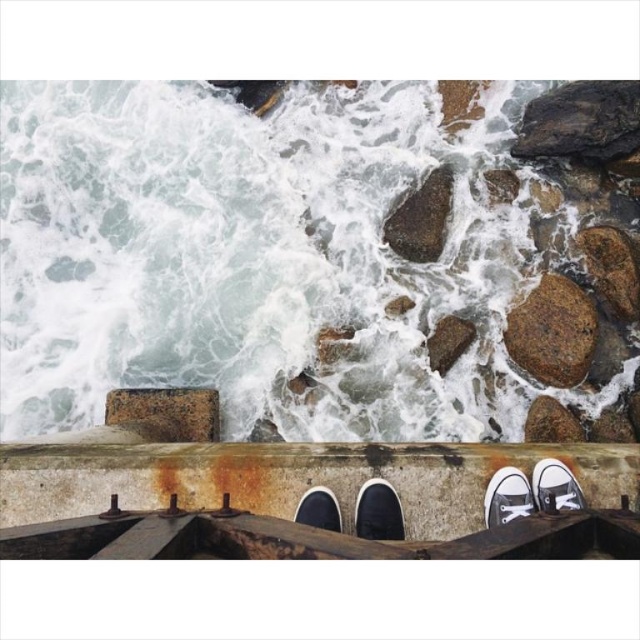
Does white canvas shoe at lower right appear on the left side of white canvas shoe at center?

In fact, white canvas shoe at lower right is to the right of white canvas shoe at center.

Does white canvas shoe at lower right have a greater height compared to white canvas shoe at center?

Yes, white canvas shoe at lower right is taller than white canvas shoe at center.

Is point (524, 480) more distant than point (305, 493)?

No.

What are the coordinates of `white canvas shoe at lower right` in the screenshot? It's located at (508, 497).

Between rusty concrete ledge at lower center and rusty stone at center-right, which one is positioned higher?

Positioned higher is rusty stone at center-right.

Can you confirm if rusty concrete ledge at lower center is positioned to the left of rusty stone at center-right?

Indeed, rusty concrete ledge at lower center is positioned on the left side of rusty stone at center-right.

Is point (604, 532) positioned behind point (577, 346)?

No, (604, 532) is closer to viewer.

What are the coordinates of `rusty concrete ledge at lower center` in the screenshot? It's located at (298, 499).

Does point (353, 394) lie behind point (154, 440)?

Yes, point (353, 394) is farther from viewer.

Identify the location of white frothy water at upper left. The width and height of the screenshot is (640, 640). (262, 257).